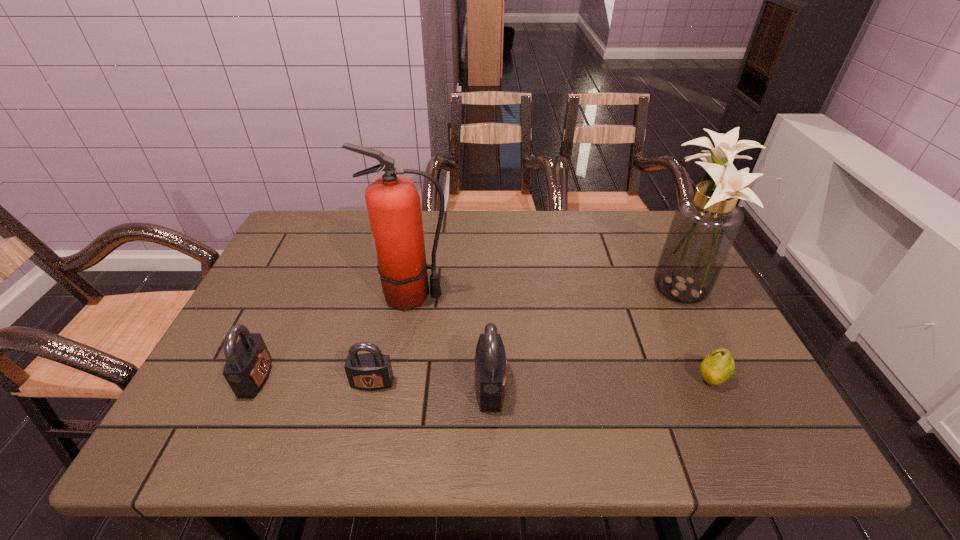
Where is `free space at the near edge`? This screenshot has height=540, width=960. free space at the near edge is located at coordinates (313, 404).

The width and height of the screenshot is (960, 540). In the image, there is a desktop. In order to click on free region at the left edge in this screenshot , I will do `click(293, 272)`.

Find the location of `vacant space at the right edge`. vacant space at the right edge is located at coordinates (682, 318).

I want to click on free space at the far left corner, so click(x=337, y=212).

The height and width of the screenshot is (540, 960). What are the coordinates of `free space at the far right corner` in the screenshot? It's located at (660, 232).

Find the location of `free space between the shortest object and the rightmost padlock`. free space between the shortest object and the rightmost padlock is located at coordinates (600, 383).

This screenshot has width=960, height=540. Find the location of `free spot between the flower arrangement and the rightmost padlock`. free spot between the flower arrangement and the rightmost padlock is located at coordinates (582, 336).

Where is `free space between the leftmost padlock and the flower arrangement`? Image resolution: width=960 pixels, height=540 pixels. free space between the leftmost padlock and the flower arrangement is located at coordinates 465,332.

Locate an element on the screen. The width and height of the screenshot is (960, 540). vacant space that's between the pear and the flower arrangement is located at coordinates (691, 332).

The width and height of the screenshot is (960, 540). Identify the location of vacant area between the fifth tallest object and the flower arrangement. (522, 334).